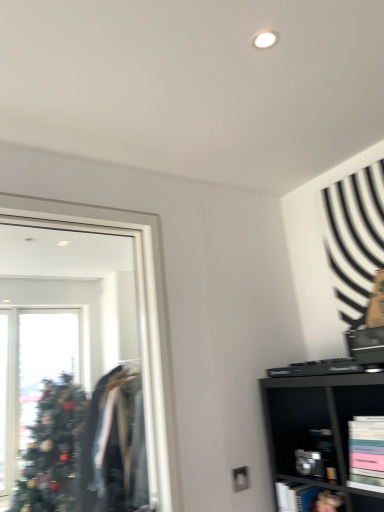
Question: Is metallic silver cabinet at lower right, arranged as the 2th cabinet when viewed from the top, located within clear glass mirror at left?

Choices:
 (A) no
 (B) yes

Answer: (A)

Question: From a real-world perspective, is clear glass mirror at left over metallic silver cabinet at lower right, arranged as the 2th cabinet when viewed from the top?

Choices:
 (A) yes
 (B) no

Answer: (A)

Question: Could you tell me if clear glass mirror at left is turned towards metallic silver cabinet at lower right, the second cabinet from the front?

Choices:
 (A) yes
 (B) no

Answer: (B)

Question: Considering the relative positions of clear glass mirror at left and metallic silver cabinet at lower right, the 1th cabinet viewed from the back, in the image provided, is clear glass mirror at left to the right of metallic silver cabinet at lower right, the 1th cabinet viewed from the back, from the viewer's perspective?

Choices:
 (A) yes
 (B) no

Answer: (B)

Question: Can you confirm if clear glass mirror at left is shorter than metallic silver cabinet at lower right, marked as the first cabinet in a bottom-to-top arrangement?

Choices:
 (A) no
 (B) yes

Answer: (A)

Question: In terms of height, does clear glass mirror at left look taller or shorter compared to metallic silver cabinet at lower right, the 1th cabinet viewed from the back?

Choices:
 (A) short
 (B) tall

Answer: (B)

Question: Is clear glass mirror at left in front of or behind metallic silver cabinet at lower right, the 1th cabinet viewed from the back, in the image?

Choices:
 (A) behind
 (B) front

Answer: (B)

Question: Considering the positions of clear glass mirror at left and metallic silver cabinet at lower right, marked as the first cabinet in a bottom-to-top arrangement, in the image, is clear glass mirror at left wider or thinner than metallic silver cabinet at lower right, marked as the first cabinet in a bottom-to-top arrangement,?

Choices:
 (A) wide
 (B) thin

Answer: (B)

Question: From the image's perspective, is clear glass mirror at left positioned above or below metallic silver cabinet at lower right, the 1th cabinet viewed from the back?

Choices:
 (A) above
 (B) below

Answer: (A)

Question: In the image, is metallic silver cabinet at lower right, the 1th cabinet viewed from the back, on the left side or the right side of clear glass mirror at left?

Choices:
 (A) right
 (B) left

Answer: (A)

Question: Considering the positions of point (324, 492) and point (135, 244), is point (324, 492) closer or farther from the camera than point (135, 244)?

Choices:
 (A) closer
 (B) farther

Answer: (A)

Question: Considering the positions of metallic silver cabinet at lower right, arranged as the 2th cabinet when viewed from the top, and clear glass mirror at left in the image, is metallic silver cabinet at lower right, arranged as the 2th cabinet when viewed from the top, taller or shorter than clear glass mirror at left?

Choices:
 (A) short
 (B) tall

Answer: (A)

Question: Considering their positions, is metallic silver cabinet at lower right, marked as the first cabinet in a bottom-to-top arrangement, located in front of or behind clear glass mirror at left?

Choices:
 (A) behind
 (B) front

Answer: (A)

Question: Considering the positions of metallic silver cabinet at lower right, the 1th cabinet viewed from the back, and matte black bookshelf at lower right, arranged as the 2th cabinet when ordered from the bottom, in the image, is metallic silver cabinet at lower right, the 1th cabinet viewed from the back, wider or thinner than matte black bookshelf at lower right, arranged as the 2th cabinet when ordered from the bottom,?

Choices:
 (A) wide
 (B) thin

Answer: (B)

Question: Would you say metallic silver cabinet at lower right, the 1th cabinet viewed from the back, is to the left or to the right of matte black bookshelf at lower right, acting as the 2th cabinet starting from the back, in the picture?

Choices:
 (A) right
 (B) left

Answer: (B)